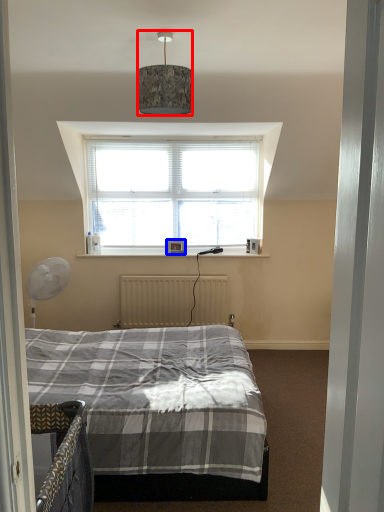
Question: Which object is closer to the camera taking this photo, lamp (highlighted by a red box) or picture frame (highlighted by a blue box)?

Choices:
 (A) lamp
 (B) picture frame

Answer: (A)